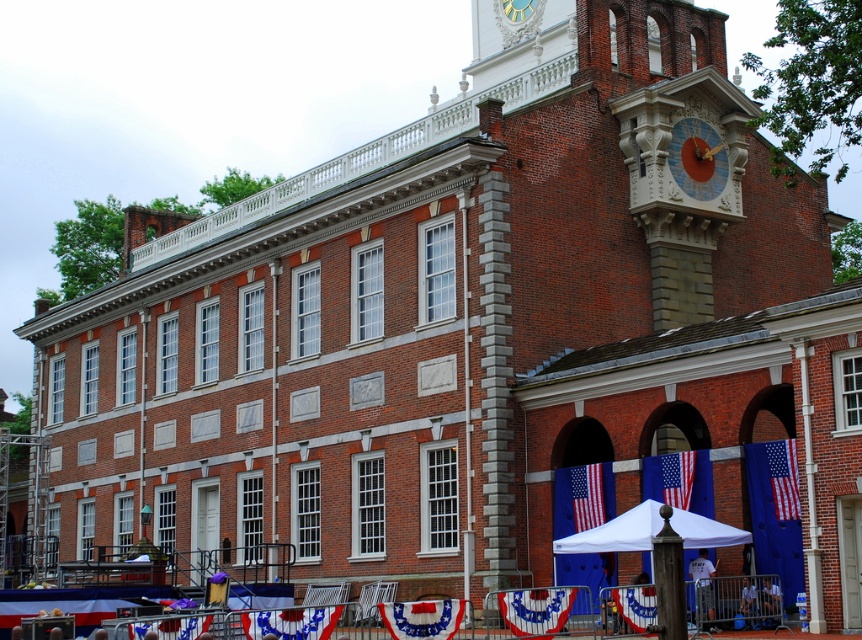
Question: Which point is closer to the camera?

Choices:
 (A) gold metallic clock at upper center
 (B) red fabric flag at lower center

Answer: (B)

Question: Which point is closer to the camera taking this photo?

Choices:
 (A) (422, 616)
 (B) (533, 600)
 (C) (516, 1)

Answer: (A)

Question: Does blue painted wood clock at upper right appear on the left side of red fabric flag at lower center?

Choices:
 (A) yes
 (B) no

Answer: (B)

Question: Among these points, which one is farthest from the camera?

Choices:
 (A) (679, 148)
 (B) (544, 632)

Answer: (A)

Question: Can you confirm if blue painted wood clock at upper right is positioned below red fabric banner at center?

Choices:
 (A) yes
 (B) no

Answer: (B)

Question: Is red fabric banner at center positioned at the back of gold metallic clock at upper center?

Choices:
 (A) no
 (B) yes

Answer: (A)